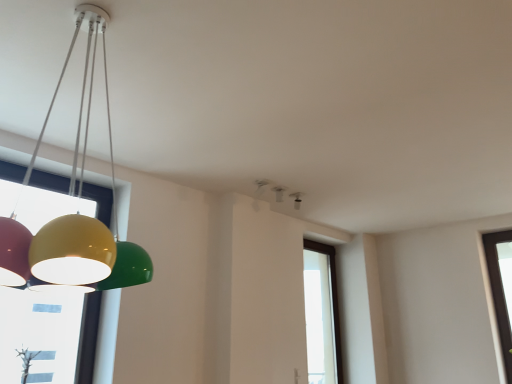
Question: Is matte black speaker at upper center, the 3th lamp when ordered from left to right, oriented away from transparent glass window at center?

Choices:
 (A) yes
 (B) no

Answer: (B)

Question: From the image's perspective, would you say matte black speaker at upper center, the 3th lamp in the front-to-back sequence, is shown under transparent glass window at center?

Choices:
 (A) yes
 (B) no

Answer: (B)

Question: Considering the relative sizes of matte black speaker at upper center, the 3th lamp in the front-to-back sequence, and transparent glass window at center in the image provided, is matte black speaker at upper center, the 3th lamp in the front-to-back sequence, thinner than transparent glass window at center?

Choices:
 (A) no
 (B) yes

Answer: (A)

Question: Does matte black speaker at upper center, placed as the 1th lamp when sorted from right to left, have a lesser height compared to transparent glass window at center?

Choices:
 (A) yes
 (B) no

Answer: (A)

Question: Can you confirm if matte black speaker at upper center, the 1th lamp positioned from the back, is positioned to the right of transparent glass window at center?

Choices:
 (A) no
 (B) yes

Answer: (A)

Question: From the image's perspective, is matte black speaker at upper center, placed as the 1th lamp when sorted from right to left, above transparent glass window at center?

Choices:
 (A) no
 (B) yes

Answer: (B)

Question: Can you confirm if glossy plastic lamp at left, the first lamp viewed from the left, is thinner than matte black speaker at upper center, the 1th lamp positioned from the back?

Choices:
 (A) yes
 (B) no

Answer: (B)

Question: Is glossy plastic lamp at left, placed as the 3th lamp when sorted from back to front, looking in the opposite direction of matte black speaker at upper center, placed as the 1th lamp when sorted from right to left?

Choices:
 (A) yes
 (B) no

Answer: (B)

Question: Considering the relative sizes of glossy plastic lamp at left, which appears as the third lamp when viewed from the right, and matte black speaker at upper center, the 1th lamp positioned from the back, in the image provided, is glossy plastic lamp at left, which appears as the third lamp when viewed from the right, bigger than matte black speaker at upper center, the 1th lamp positioned from the back,?

Choices:
 (A) no
 (B) yes

Answer: (B)

Question: Can you confirm if glossy plastic lamp at left, which appears as the third lamp when viewed from the right, is wider than matte black speaker at upper center, the 1th lamp positioned from the back?

Choices:
 (A) no
 (B) yes

Answer: (B)

Question: Is glossy plastic lamp at left, arranged as the 1th lamp when viewed from the front, aimed at matte black speaker at upper center, placed as the 1th lamp when sorted from right to left?

Choices:
 (A) no
 (B) yes

Answer: (A)

Question: Is glossy plastic lamp at left, the first lamp viewed from the left, positioned behind matte black speaker at upper center, the 3th lamp in the front-to-back sequence?

Choices:
 (A) no
 (B) yes

Answer: (A)

Question: From a real-world perspective, is transparent glass window at center physically above glossy plastic lamp at left, placed as the 3th lamp when sorted from back to front?

Choices:
 (A) no
 (B) yes

Answer: (A)